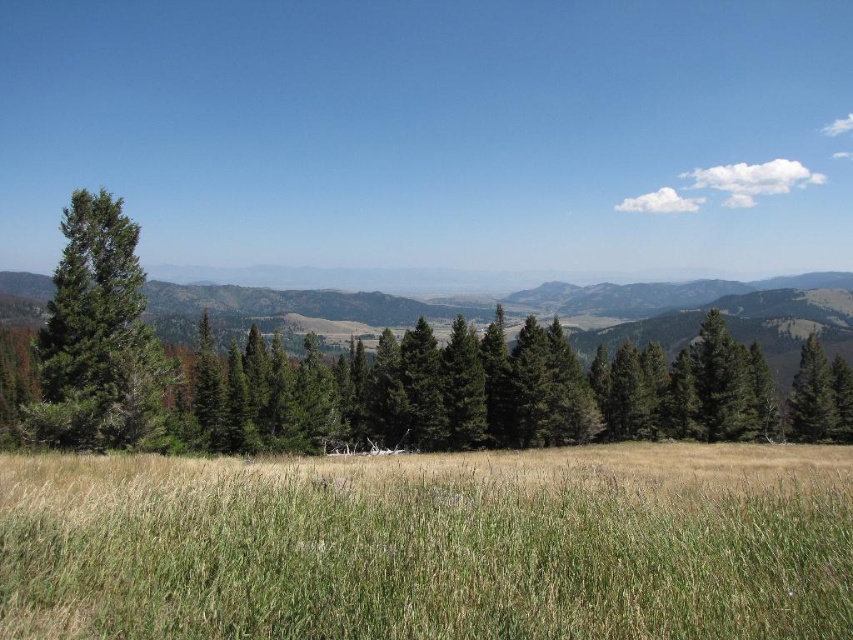
Can you confirm if green grassy field at center is smaller than green matte tree at left?

No, green grassy field at center is not smaller than green matte tree at left.

Is point (842, 461) less distant than point (70, 349)?

No, (842, 461) is further to viewer.

Identify the location of green grassy field at center. (431, 545).